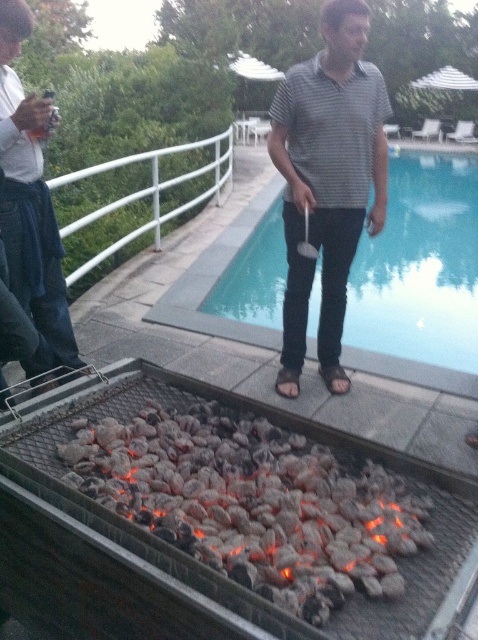
Who is more forward, (142, 454) or (395, 314)?

Positioned in front is point (142, 454).

In order to click on charcoal at lower center in this screenshot , I will do `click(252, 502)`.

Where is `charcoal at lower center`? charcoal at lower center is located at coordinates (252, 502).

Does charcoal at lower center appear on the right side of gray striped shirt at center?

No, charcoal at lower center is not to the right of gray striped shirt at center.

Where is `charcoal at lower center`? The width and height of the screenshot is (478, 640). charcoal at lower center is located at coordinates (252, 502).

What do you see at coordinates (252, 502) in the screenshot? I see `charcoal at lower center` at bounding box center [252, 502].

Who is taller, charcoal at lower center or brushed metal water at bottle left?

Standing taller between the two is brushed metal water at bottle left.

The height and width of the screenshot is (640, 478). In order to click on charcoal at lower center in this screenshot , I will do point(252,502).

Identify the location of charcoal at lower center. (252, 502).